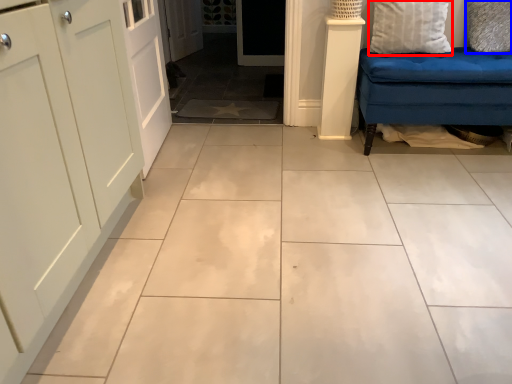
Question: Which point is further to the camera, pillow (highlighted by a red box) or pillow (highlighted by a blue box)?

Choices:
 (A) pillow
 (B) pillow

Answer: (B)